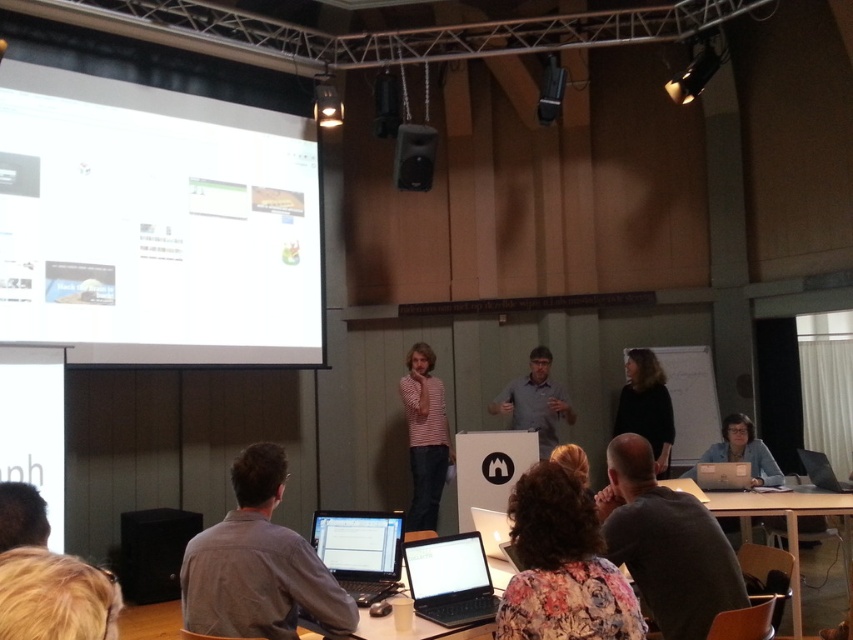
Can you confirm if black matte speaker at lower left is smaller than white glossy laptop at center?

No.

Does black matte speaker at lower left have a larger size compared to white glossy laptop at center?

Yes, black matte speaker at lower left is bigger than white glossy laptop at center.

Does point (119, 566) come behind point (428, 596)?

Yes.

The image size is (853, 640). Identify the location of black matte speaker at lower left. (154, 552).

Can you confirm if gray shirt at lower left is taller than floral fabric shirt at lower center?

Yes.

Between point (189, 598) and point (526, 538), which one is positioned behind?

Positioned behind is point (189, 598).

Describe the element at coordinates (258, 564) in the screenshot. The image size is (853, 640). I see `gray shirt at lower left` at that location.

This screenshot has width=853, height=640. I want to click on gray shirt at lower left, so click(258, 564).

Is point (399, 531) more distant than point (22, 528)?

Yes.

Can you confirm if matte black laptop at lower center is positioned above dark brown hair at lower left?

Incorrect, matte black laptop at lower center is not positioned above dark brown hair at lower left.

Which is in front, point (363, 557) or point (19, 492)?

Point (19, 492)

Locate an element on the screen. This screenshot has height=640, width=853. matte black laptop at lower center is located at coordinates [358, 541].